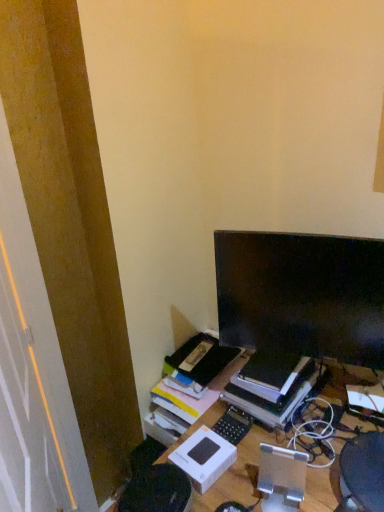
Find the location of a particular element. The width and height of the screenshot is (384, 512). hardcover book at center is located at coordinates (278, 400).

Find the location of a particular element. white matte cardboard box at center is located at coordinates (204, 457).

Locate an element on the screen. matte black monitor at upper right is located at coordinates (302, 295).

From the picture: From a real-world perspective, is matte black monitor at upper right above or below hardcover book at center?

In terms of real-world spatial position, matte black monitor at upper right is above hardcover book at center.

In terms of size, does matte black monitor at upper right appear bigger or smaller than hardcover book at center?

Clearly, matte black monitor at upper right is smaller in size than hardcover book at center.

Which point is more forward, (225, 291) or (286, 397)?

The point (225, 291) is more forward.

Where is `computer monitor above the white matte cardboard box at center (from the image's perspective)`? The width and height of the screenshot is (384, 512). computer monitor above the white matte cardboard box at center (from the image's perspective) is located at coordinates (302, 295).

Does matte black monitor at upper right touch white matte cardboard box at center?

No, matte black monitor at upper right is not touching white matte cardboard box at center.

In terms of height, does matte black monitor at upper right look taller or shorter compared to white matte cardboard box at center?

In the image, matte black monitor at upper right appears to be taller than white matte cardboard box at center.

From the image's perspective, is matte black monitor at upper right beneath white matte cardboard box at center?

Incorrect, from the image's perspective, matte black monitor at upper right is higher than white matte cardboard box at center.

From a real-world perspective, which object stands above the other?

In real-world perspective, matte black monitor at upper right is above.

Does matte black monitor at upper right have a larger size compared to black matte keyboard at center?

Correct, matte black monitor at upper right is larger in size than black matte keyboard at center.

Based on their positions, is matte black monitor at upper right located to the left or right of black matte keyboard at center?

matte black monitor at upper right is positioned on black matte keyboard at center's right side.

How many degrees apart are the facing directions of matte black monitor at upper right and black matte keyboard at center?

They differ by 19.6 degrees in their facing directions.

Is hardcover book at center bigger than matte black monitor at upper right?

Yes.

Is matte black monitor at upper right at the back of hardcover book at center?

No.

Which of these two, hardcover book at center or matte black monitor at upper right, stands shorter?

hardcover book at center.

Is hardcover book at center in front of matte black monitor at upper right?

No.

From a real-world perspective, is black matte keyboard at center located higher than white matte cardboard box at center?

No, from a real-world perspective, black matte keyboard at center is not on top of white matte cardboard box at center.

Image resolution: width=384 pixels, height=512 pixels. What are the coordinates of `computer keyboard above the white matte cardboard box at center (from the image's perspective)` in the screenshot? It's located at (233, 425).

Is black matte keyboard at center far away from white matte cardboard box at center?

black matte keyboard at center is actually quite close to white matte cardboard box at center.

Is black matte keyboard at center facing away from white matte cardboard box at center?

No, black matte keyboard at center is not facing away from white matte cardboard box at center.

Can you confirm if white matte cardboard box at center is wider than hardcover book at center?

In fact, white matte cardboard box at center might be narrower than hardcover book at center.

Is white matte cardboard box at center bigger or smaller than hardcover book at center?

In the image, white matte cardboard box at center appears to be smaller than hardcover book at center.

Is white matte cardboard box at center not close to hardcover book at center?

white matte cardboard box at center is near hardcover book at center, not far away.

Can you confirm if white matte cardboard box at center is taller than hardcover book at center?

Incorrect, the height of white matte cardboard box at center is not larger of that of hardcover book at center.

Is hardcover book at center situated inside white matte cardboard box at center or outside?

hardcover book at center lies outside white matte cardboard box at center.

Considering the sizes of objects hardcover book at center and white matte cardboard box at center in the image provided, who is shorter, hardcover book at center or white matte cardboard box at center?

Standing shorter between the two is white matte cardboard box at center.

You are a GUI agent. You are given a task and a screenshot of the screen. Output one action in this format:
    pyautogui.click(x=<x>, y=<y>)
    Task: Click on the cardboard box on the left of hardcover book at center
    This screenshot has width=384, height=512.
    Given the screenshot: What is the action you would take?
    pyautogui.click(x=204, y=457)

Which of these two, hardcover book at center or white matte cardboard box at center, is thinner?

white matte cardboard box at center is thinner.

Where is `book lying behind the matte black monitor at upper right`? book lying behind the matte black monitor at upper right is located at coordinates (278, 400).

Where is `cardboard box that appears below the matte black monitor at upper right (from a real-world perspective)`? The width and height of the screenshot is (384, 512). cardboard box that appears below the matte black monitor at upper right (from a real-world perspective) is located at coordinates (204, 457).

Looking at the image, which one is located further to hardcover book at center, matte black monitor at upper right or black matte keyboard at center?

Based on the image, matte black monitor at upper right appears to be further to hardcover book at center.

Based on their spatial positions, is black matte keyboard at center or matte black monitor at upper right closer to white matte cardboard box at center?

The object closer to white matte cardboard box at center is black matte keyboard at center.

Considering their positions, is matte black monitor at upper right positioned closer to white matte cardboard box at center than black matte keyboard at center?

black matte keyboard at center lies closer to white matte cardboard box at center than the other object.

Based on their spatial positions, is white matte cardboard box at center or black matte keyboard at center closer to matte black monitor at upper right?

The object closer to matte black monitor at upper right is black matte keyboard at center.

From the image, which object appears to be farther from matte black monitor at upper right, hardcover book at center or black matte keyboard at center?

black matte keyboard at center is positioned further to the anchor matte black monitor at upper right.

Looking at the image, which one is located closer to white matte cardboard box at center, hardcover book at center or matte black monitor at upper right?

hardcover book at center is positioned closer to the anchor white matte cardboard box at center.

Considering their positions, is matte black monitor at upper right positioned further to hardcover book at center than white matte cardboard box at center?

Among the two, matte black monitor at upper right is located further to hardcover book at center.

When comparing their distances from hardcover book at center, does black matte keyboard at center or matte black monitor at upper right seem further?

Among the two, matte black monitor at upper right is located further to hardcover book at center.

The width and height of the screenshot is (384, 512). What are the coordinates of `book that lies between matte black monitor at upper right and white matte cardboard box at center from top to bottom` in the screenshot? It's located at (278, 400).

Where is `computer keyboard situated between white matte cardboard box at center and hardcover book at center from left to right`? computer keyboard situated between white matte cardboard box at center and hardcover book at center from left to right is located at coordinates (233, 425).

You are a GUI agent. You are given a task and a screenshot of the screen. Output one action in this format:
    pyautogui.click(x=<x>, y=<y>)
    Task: Click on the book between matte black monitor at upper right and black matte keyboard at center in the vertical direction
    
    Given the screenshot: What is the action you would take?
    pyautogui.click(x=278, y=400)

Locate an element on the screen. The width and height of the screenshot is (384, 512). computer keyboard between matte black monitor at upper right and white matte cardboard box at center in the vertical direction is located at coordinates [x=233, y=425].